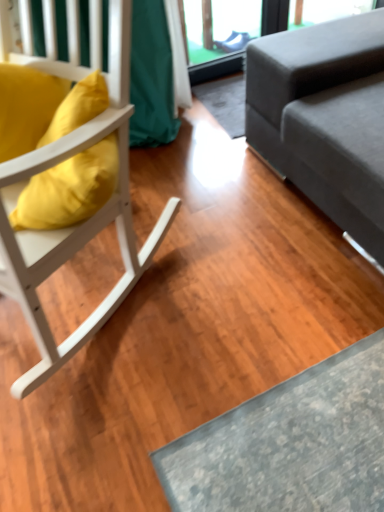
In order to click on free space on the front side of white wood chair at left in this screenshot , I will do `click(148, 433)`.